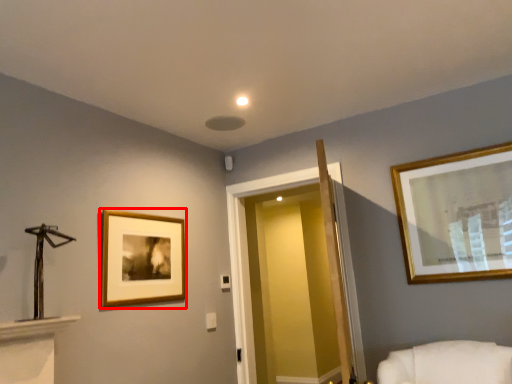
Question: From the image's perspective, where is picture frame (annotated by the red box) located relative to glass door?

Choices:
 (A) above
 (B) below

Answer: (A)